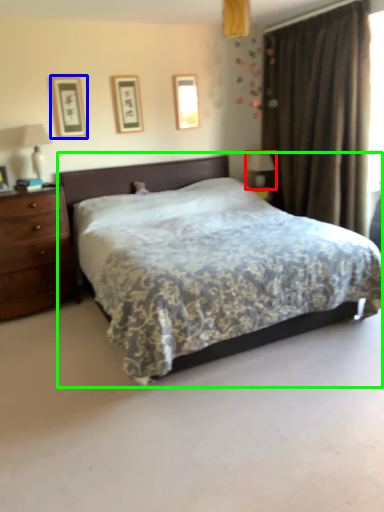
Question: Which object is the farthest from table lamp (highlighted by a red box)? Choose among these: picture frame (highlighted by a blue box) or bed (highlighted by a green box).

Choices:
 (A) picture frame
 (B) bed

Answer: (A)